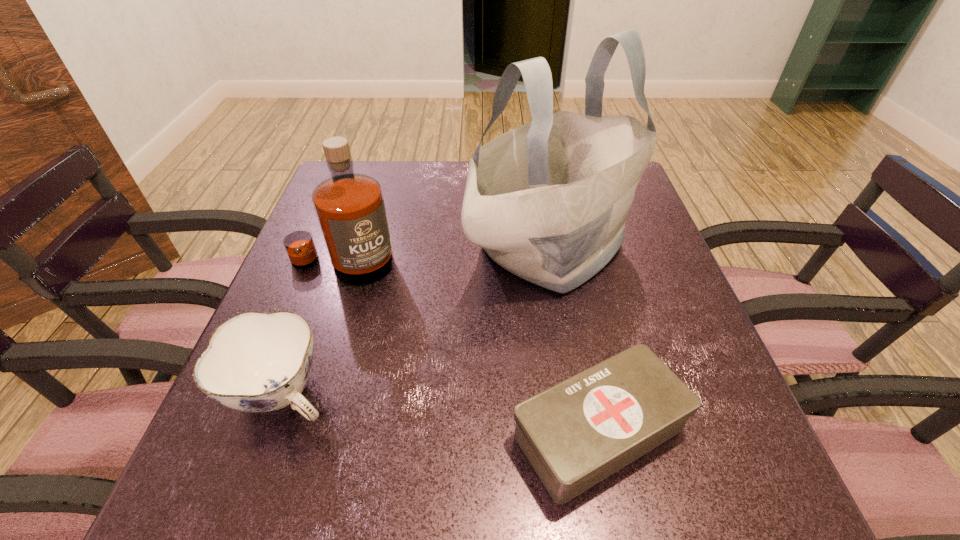
You are a GUI agent. You are given a task and a screenshot of the screen. Output one action in this format:
    pyautogui.click(x=<x>, y=<y>)
    Task: Click on the liquor situated at the left edge
    
    Given the screenshot: What is the action you would take?
    pyautogui.click(x=350, y=208)

This screenshot has width=960, height=540. Find the location of `chinaware that is at the left edge`. chinaware that is at the left edge is located at coordinates (x=256, y=361).

Image resolution: width=960 pixels, height=540 pixels. Find the location of `shopping bag present at the right edge`. shopping bag present at the right edge is located at coordinates (547, 201).

What are the coordinates of `the first-aid kit that is at the right edge` in the screenshot? It's located at pyautogui.click(x=575, y=434).

Locate an element on the screen. The image size is (960, 540). object present at the far right corner is located at coordinates (547, 201).

The width and height of the screenshot is (960, 540). Find the location of `object at the near right corner`. object at the near right corner is located at coordinates (575, 434).

At what (x,y) coordinates should I click in order to perform the action: click on vacant space at the far edge of the desktop. Please return your answer as a coordinate pair (x, y). This screenshot has height=540, width=960. Looking at the image, I should click on pos(447,198).

This screenshot has height=540, width=960. In order to click on free region at the right edge in this screenshot , I will do `click(620, 269)`.

Locate an element on the screen. Image resolution: width=960 pixels, height=540 pixels. vacant space at the far right corner of the desktop is located at coordinates [x=642, y=204].

This screenshot has height=540, width=960. In the image, there is a desktop. In order to click on free space at the near right corner in this screenshot , I will do `click(744, 490)`.